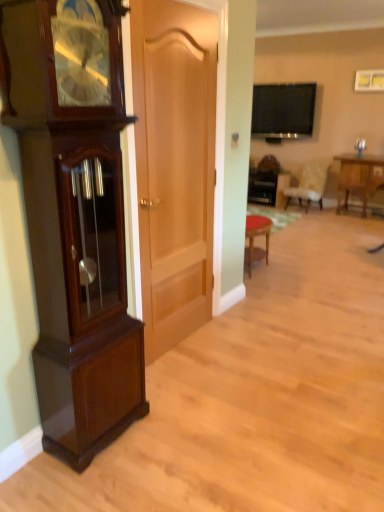
Locate an element on the screen. Image resolution: width=384 pixels, height=512 pixels. free spot to the right of light brown wood door at center is located at coordinates (238, 343).